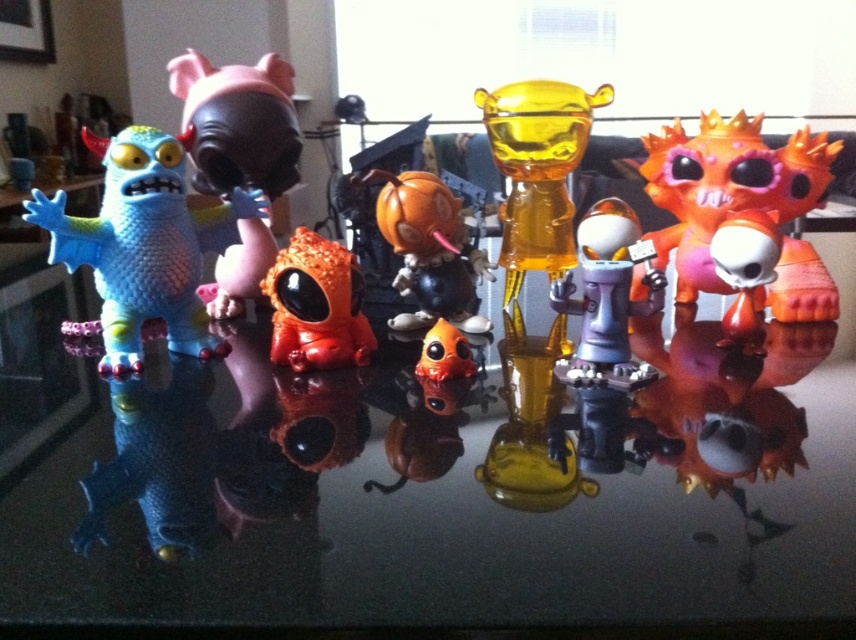
Question: Which point is farther from the camera taking this photo?

Choices:
 (A) tap(503, 202)
 (B) tap(409, 262)

Answer: (A)

Question: In this image, where is matte plastic pig at center located relative to orange matte alien at center?

Choices:
 (A) left
 (B) right

Answer: (A)

Question: Which object appears farthest from the camera in this image?

Choices:
 (A) orange matte pumpkin at center
 (B) metallic gray robot at center

Answer: (A)

Question: Can you confirm if matte blue plush toy at left is thinner than orange glossy skull at center right?

Choices:
 (A) yes
 (B) no

Answer: (A)

Question: Which point is closer to the camera?

Choices:
 (A) (375, 204)
 (B) (242, 196)

Answer: (B)

Question: Can you confirm if matte plastic pig at center is thinner than orange matte pumpkin at center?

Choices:
 (A) yes
 (B) no

Answer: (A)